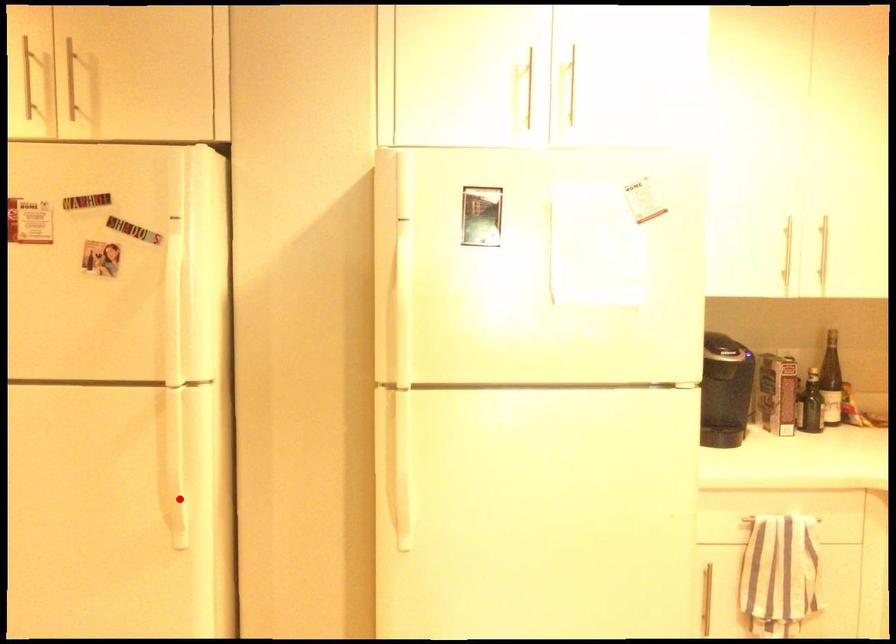
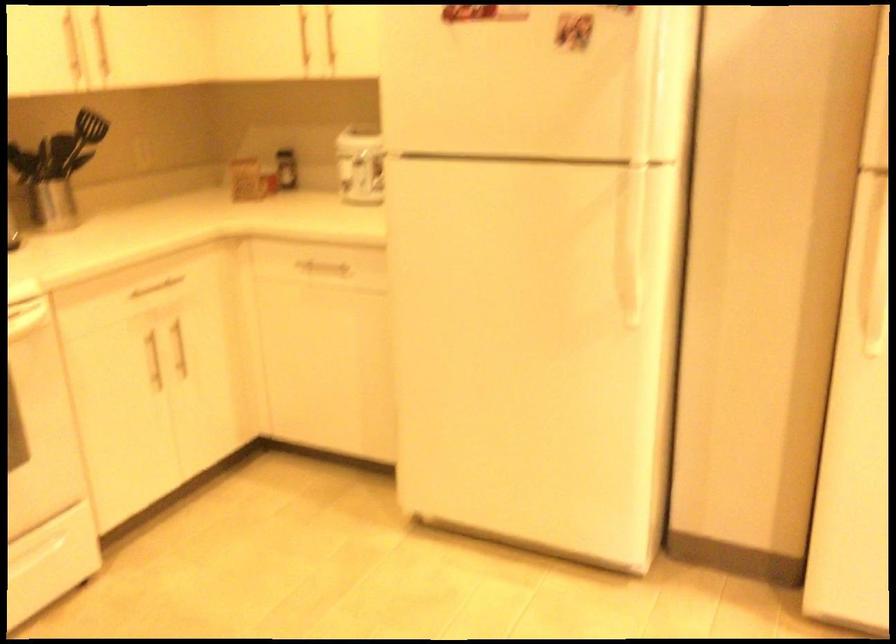
The point at the highlighted location is marked in the first image. Where is the corresponding point in the second image?

(634, 277)